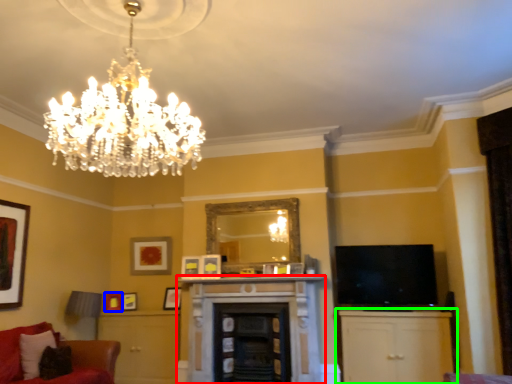
Question: Which object is the farthest from fireplace (highlighted by a red box)? Choose among these: picture frame (highlighted by a blue box) or cabinetry (highlighted by a green box).

Choices:
 (A) picture frame
 (B) cabinetry

Answer: (A)